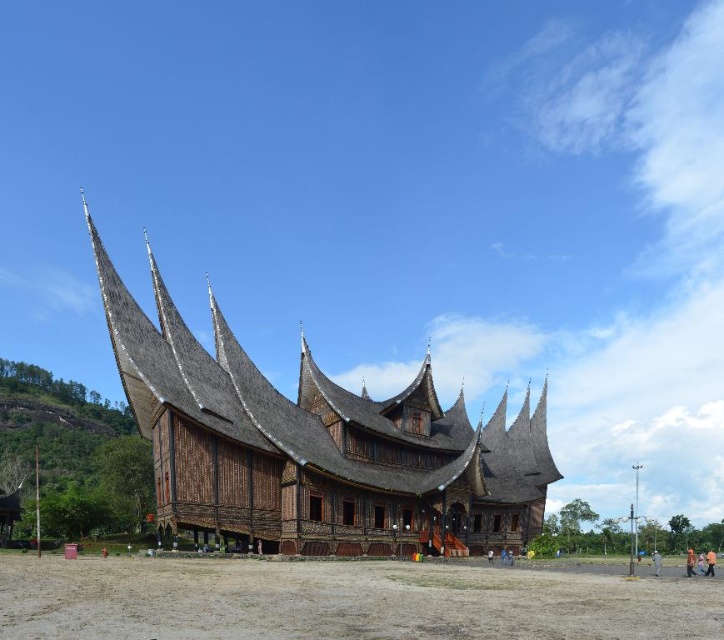
Question: Does brown wooden temple at center appear under brown sandy dirt field at lower center?

Choices:
 (A) yes
 (B) no

Answer: (B)

Question: Which point is farther from the camera taking this photo?

Choices:
 (A) (198, 432)
 (B) (336, 612)

Answer: (A)

Question: Is brown wooden temple at center thinner than brown sandy dirt field at lower center?

Choices:
 (A) yes
 (B) no

Answer: (B)

Question: Can you confirm if brown wooden temple at center is wider than brown sandy dirt field at lower center?

Choices:
 (A) yes
 (B) no

Answer: (A)